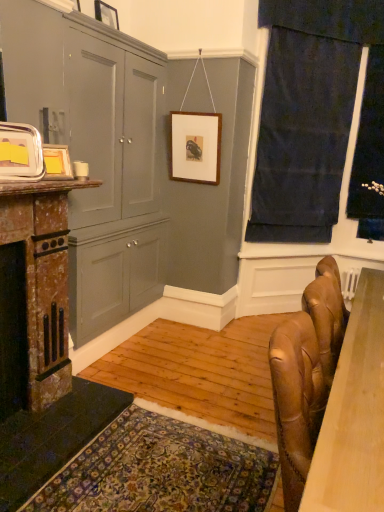
Question: Is matte gray cabinet at left wider than black velvet curtain at right?

Choices:
 (A) yes
 (B) no

Answer: (A)

Question: Does matte gray cabinet at left have a larger size compared to black velvet curtain at right?

Choices:
 (A) no
 (B) yes

Answer: (B)

Question: Is matte gray cabinet at left not inside black velvet curtain at right?

Choices:
 (A) yes
 (B) no

Answer: (A)

Question: Is matte gray cabinet at left smaller than black velvet curtain at right?

Choices:
 (A) yes
 (B) no

Answer: (B)

Question: From a real-world perspective, is matte gray cabinet at left over black velvet curtain at right?

Choices:
 (A) yes
 (B) no

Answer: (B)

Question: Relative to black velvet curtain at right, is matte yellow picture frame at left, the third picture frame when ordered from back to front, in front or behind?

Choices:
 (A) behind
 (B) front

Answer: (B)

Question: Is matte yellow picture frame at left, the 2th picture frame in the front-to-back sequence, taller or shorter than black velvet curtain at right?

Choices:
 (A) short
 (B) tall

Answer: (A)

Question: Does point (59, 144) appear closer or farther from the camera than point (360, 129)?

Choices:
 (A) farther
 (B) closer

Answer: (B)

Question: In the image, is matte yellow picture frame at left, which ranks as the second picture frame in bottom-to-top order, on the left side or the right side of black velvet curtain at right?

Choices:
 (A) left
 (B) right

Answer: (A)

Question: Do you think matte gray cabinet at left is within wooden picture frame at center, which is the fourth picture frame from front to back, or outside of it?

Choices:
 (A) inside
 (B) outside

Answer: (B)

Question: Is matte gray cabinet at left in front of or behind wooden picture frame at center, which is the fourth picture frame from front to back, in the image?

Choices:
 (A) front
 (B) behind

Answer: (A)

Question: Considering the relative positions of matte gray cabinet at left and wooden picture frame at center, the fourth picture frame viewed from the left, in the image provided, is matte gray cabinet at left to the left or to the right of wooden picture frame at center, the fourth picture frame viewed from the left,?

Choices:
 (A) left
 (B) right

Answer: (A)

Question: Considering the positions of matte gray cabinet at left and wooden picture frame at center, the fourth picture frame viewed from the left, in the image, is matte gray cabinet at left bigger or smaller than wooden picture frame at center, the fourth picture frame viewed from the left,?

Choices:
 (A) big
 (B) small

Answer: (A)

Question: From a real-world perspective, is wooden picture frame at center, which is the fourth picture frame from front to back, physically located above or below wooden picture frame at upper center, which ranks as the second picture frame in right-to-left order?

Choices:
 (A) above
 (B) below

Answer: (B)

Question: In the image, is wooden picture frame at center, marked as the 2th picture frame in a top-to-bottom arrangement, on the left side or the right side of wooden picture frame at upper center, marked as the fourth picture frame in a bottom-to-top arrangement?

Choices:
 (A) right
 (B) left

Answer: (A)